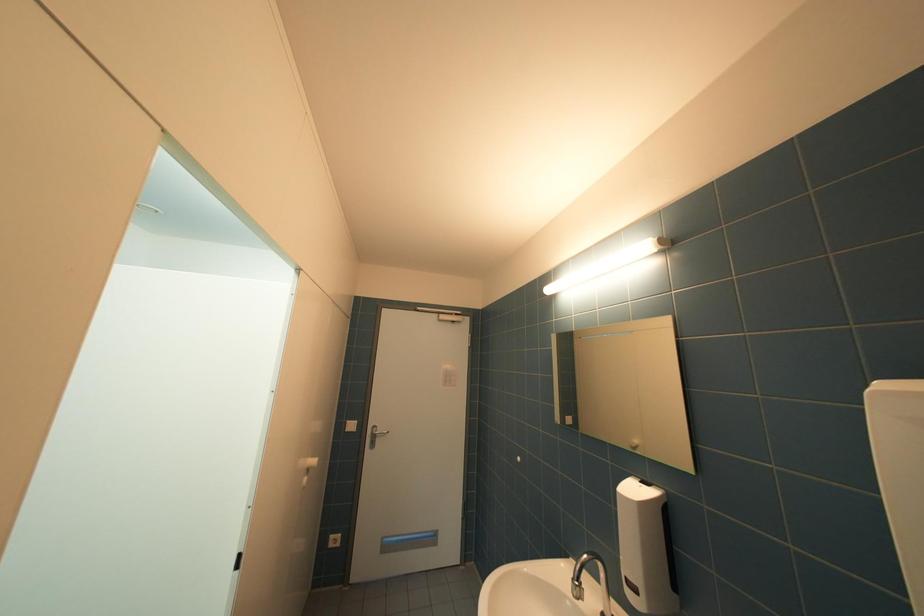
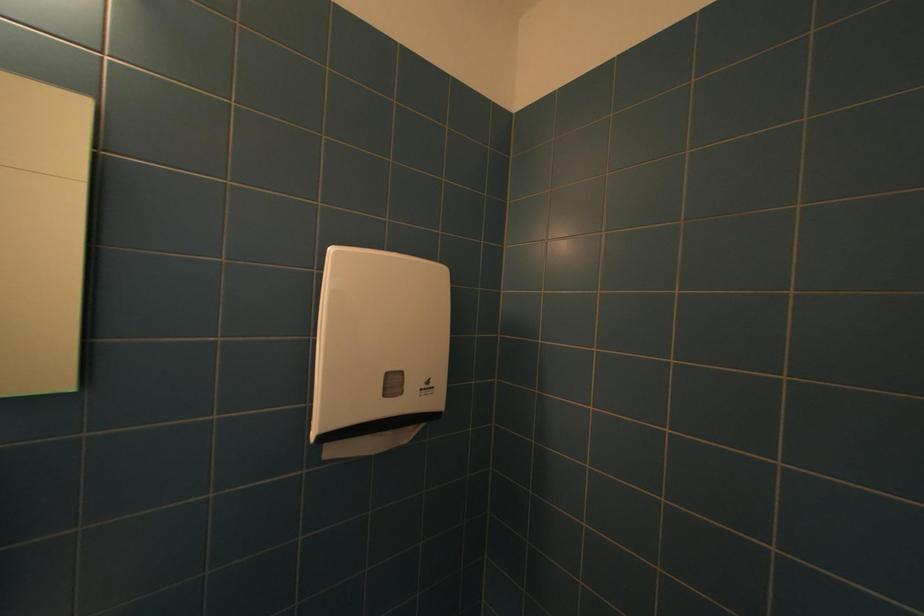
Question: The images are taken continuously from a first-person perspective. In which direction is your viewpoint rotating?

Choices:
 (A) Left
 (B) Right
 (C) Up
 (D) Down

Answer: (B)